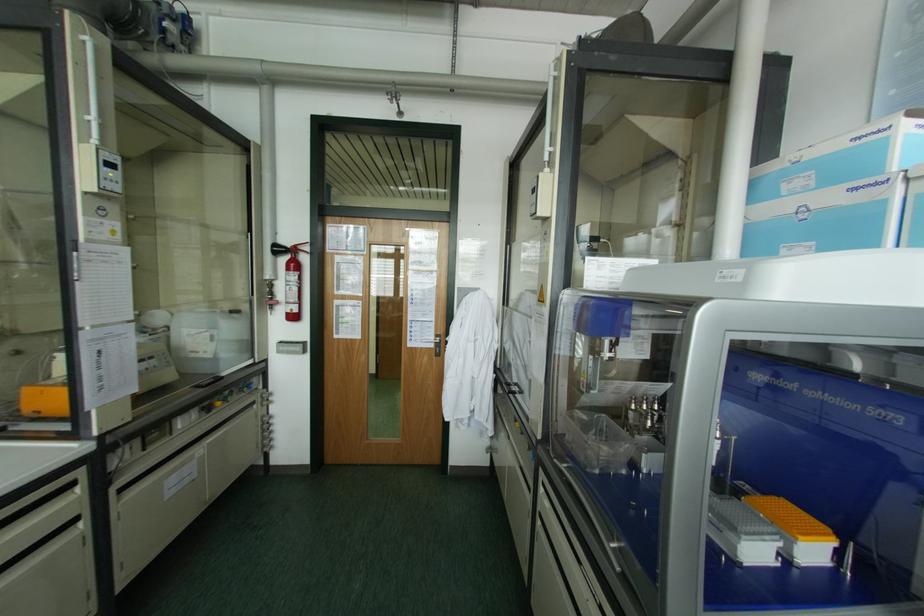
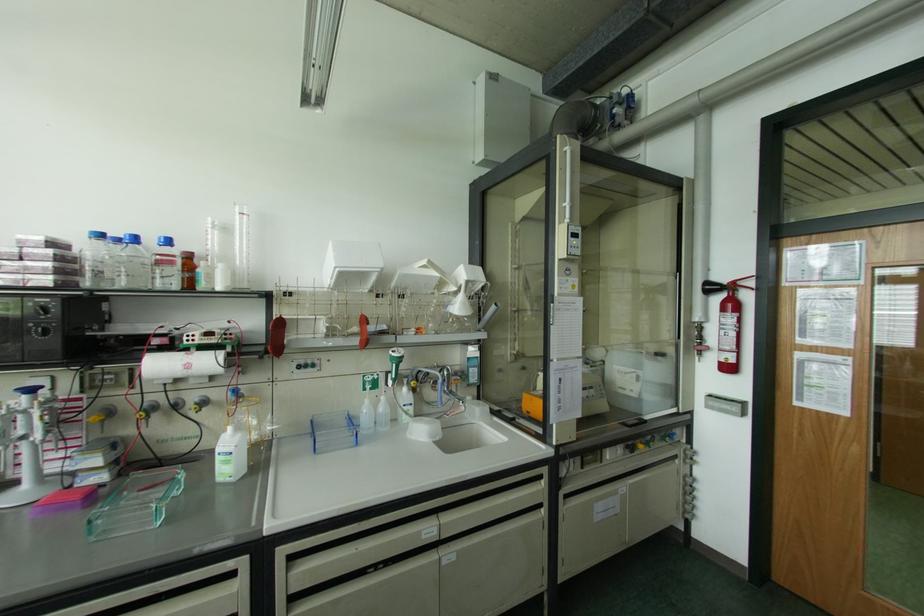
Find the pixel in the second image that matches pixel 294 249 in the first image.

(732, 286)